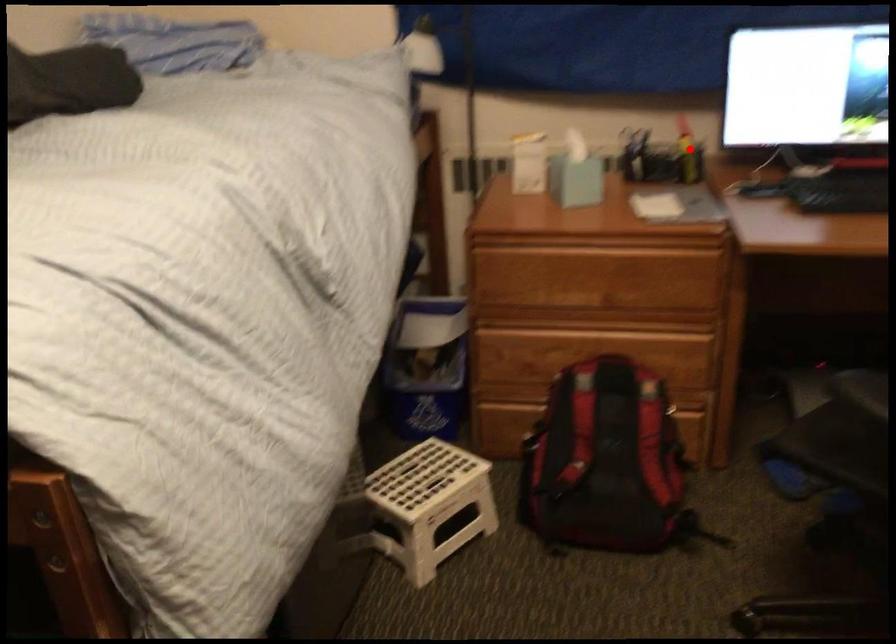
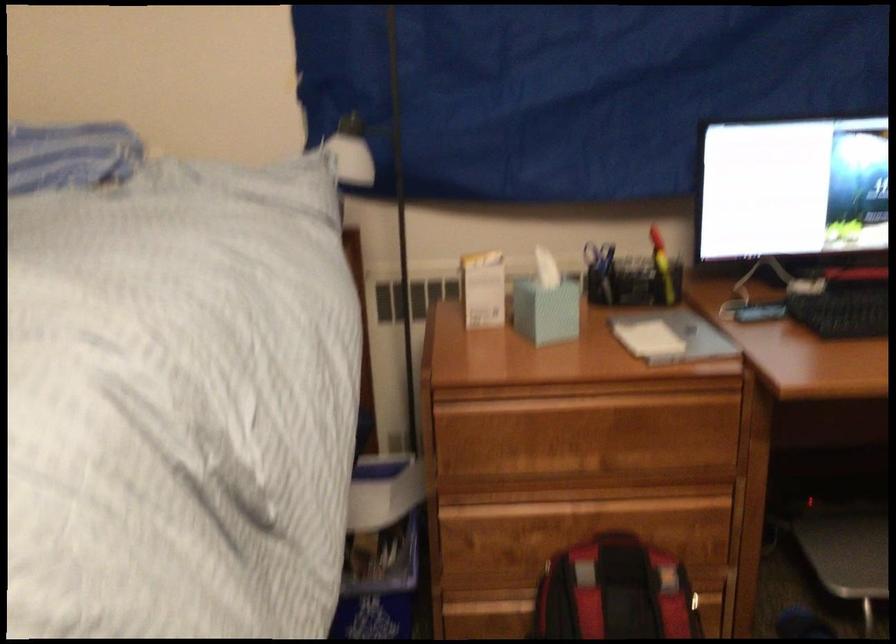
Question: I am providing you with two images of the same scene from different viewpoints. Given a red point in image1, look at the same physical point in image2. Is it:

Choices:
 (A) Closer to the viewpoint
 (B) Farther from the viewpoint

Answer: (A)